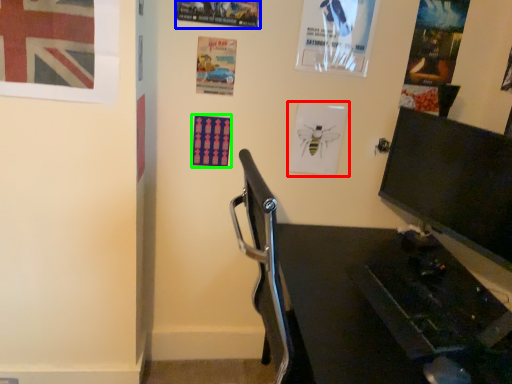
Question: Which object is positioned closest to poster page (highlighted by a red box)? Select from poster page (highlighted by a blue box) and poster page (highlighted by a green box).

Choices:
 (A) poster page
 (B) poster page

Answer: (B)